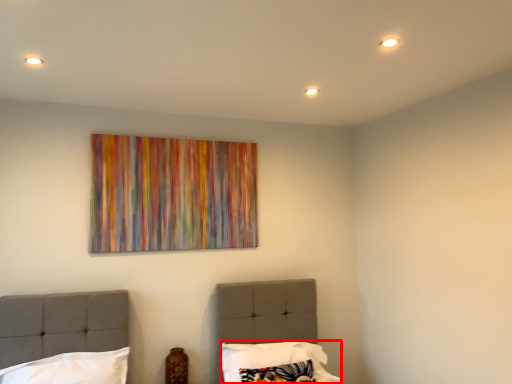
Question: From the image, what is the correct spatial relationship of pillow (annotated by the red box) in relation to pillow?

Choices:
 (A) right
 (B) left

Answer: (A)